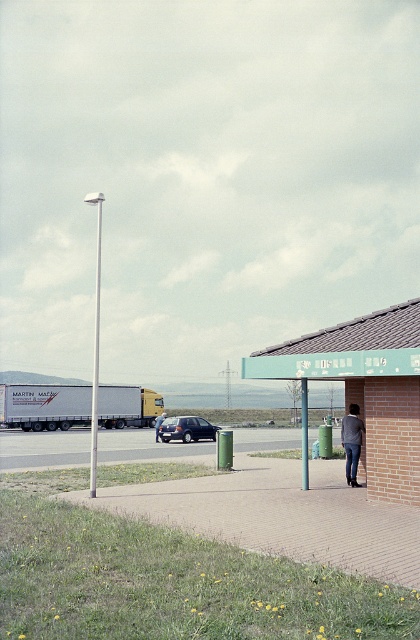
Can you confirm if white matte trailer truck at left is positioned above light blue jeans at center?

Indeed, white matte trailer truck at left is positioned over light blue jeans at center.

The height and width of the screenshot is (640, 420). What are the coordinates of `white matte trailer truck at left` in the screenshot? It's located at (44, 404).

You are a GUI agent. You are given a task and a screenshot of the screen. Output one action in this format:
    pyautogui.click(x=<x>, y=<y>)
    Task: Click on the white matte trailer truck at left
    The image size is (420, 640).
    Given the screenshot: What is the action you would take?
    pyautogui.click(x=44, y=404)

Which is more to the left, smooth concrete pavement at center or gray sweater at center?

Positioned to the left is smooth concrete pavement at center.

Who is more forward, (78, 461) or (354, 417)?

Positioned in front is point (354, 417).

I want to click on smooth concrete pavement at center, so click(x=44, y=449).

Is brick pavement at center to the left of dark blue metallic hatchback at center from the viewer's perspective?

Incorrect, brick pavement at center is not on the left side of dark blue metallic hatchback at center.

You are a GUI agent. You are given a task and a screenshot of the screen. Output one action in this format:
    pyautogui.click(x=<x>, y=<y>)
    Task: Click on the brick pavement at center
    
    Given the screenshot: What is the action you would take?
    pyautogui.click(x=280, y=515)

Where is `brick pavement at center`? This screenshot has width=420, height=640. brick pavement at center is located at coordinates (280, 515).